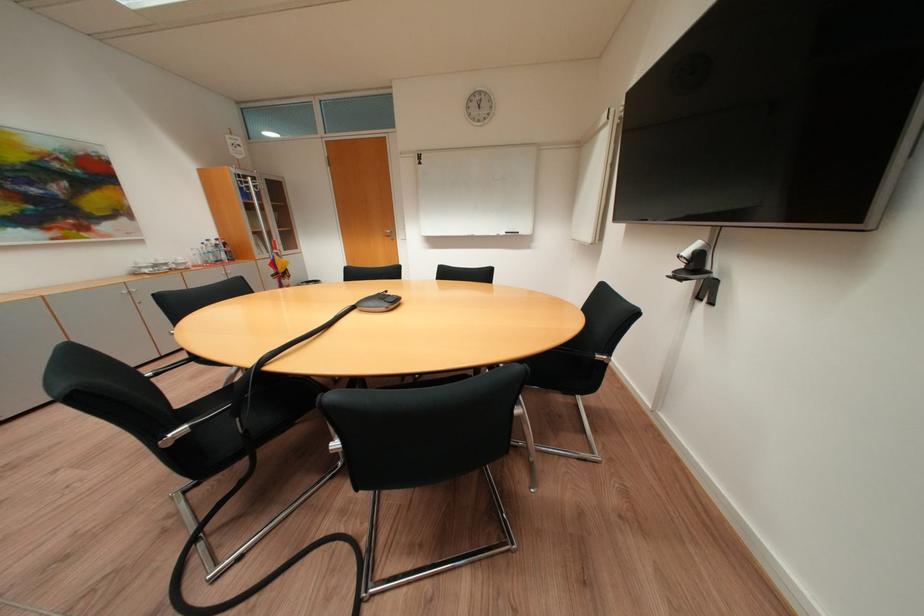
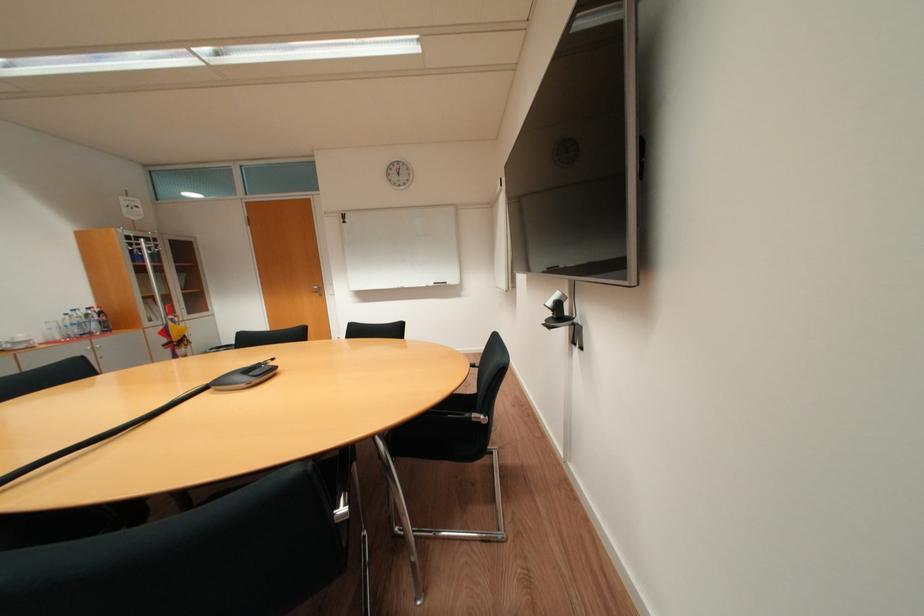
Question: In a continuous first-person perspective shot, in which direction is the camera moving?

Choices:
 (A) Left
 (B) Right
 (C) Forward
 (D) Backward

Answer: (B)